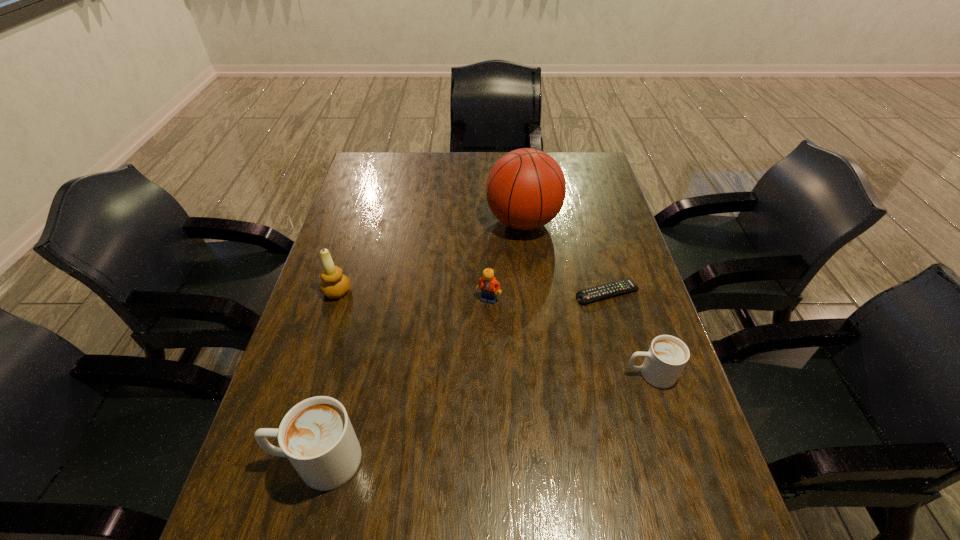
The height and width of the screenshot is (540, 960). I want to click on remote control present at the right edge, so click(611, 289).

This screenshot has height=540, width=960. Find the location of `object that is at the near left corner`. object that is at the near left corner is located at coordinates (316, 435).

Image resolution: width=960 pixels, height=540 pixels. I want to click on vacant space at the far edge of the desktop, so click(x=462, y=165).

At what (x,y) coordinates should I click in order to perform the action: click on free space at the near edge of the desktop. Please return your answer as a coordinate pair (x, y). The height and width of the screenshot is (540, 960). Looking at the image, I should click on (476, 499).

This screenshot has width=960, height=540. Find the location of `vacant region at the left edge`. vacant region at the left edge is located at coordinates (345, 272).

The image size is (960, 540). I want to click on free space at the right edge of the desktop, so (612, 304).

The height and width of the screenshot is (540, 960). I want to click on blank space at the far left corner, so click(x=394, y=167).

In the image, there is a desktop. Where is `vacant space at the near right corner`? The image size is (960, 540). vacant space at the near right corner is located at coordinates (698, 492).

Where is `vacant area that lies between the farther cappuccino and the third shortest object`? The height and width of the screenshot is (540, 960). vacant area that lies between the farther cappuccino and the third shortest object is located at coordinates (569, 336).

Locate an element on the screen. free space between the candle_holder and the Lego is located at coordinates tap(413, 295).